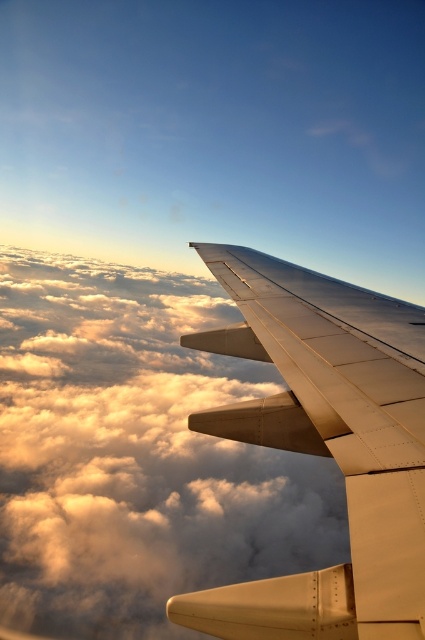
Is cloudy white at upper center thinner than metallic silver wing at upper center?

In fact, cloudy white at upper center might be wider than metallic silver wing at upper center.

Can you confirm if cloudy white at upper center is smaller than metallic silver wing at upper center?

Incorrect, cloudy white at upper center is not smaller in size than metallic silver wing at upper center.

Identify the location of cloudy white at upper center. (136, 454).